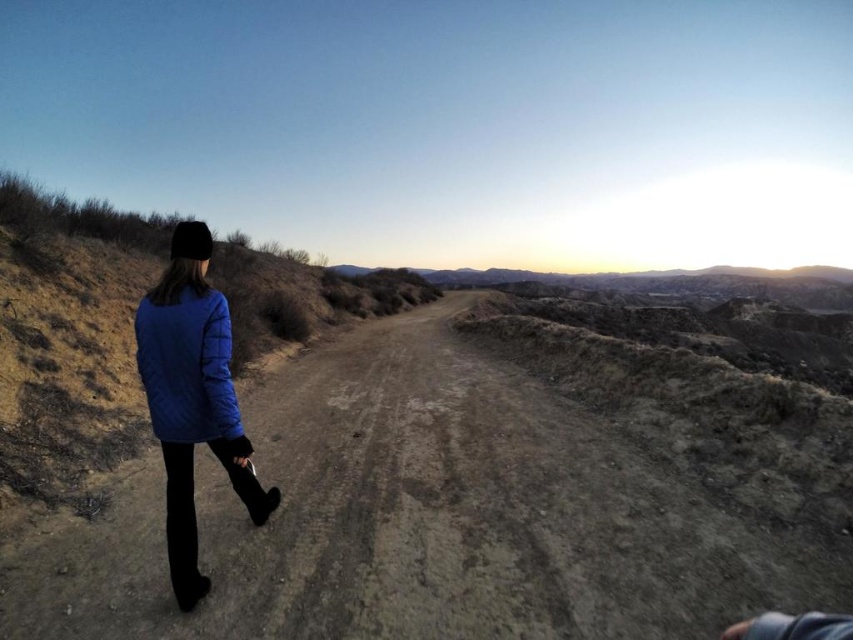
Question: Is blue quilted jacket at lower left thinner than matte blue jacket at lower left?

Choices:
 (A) yes
 (B) no

Answer: (B)

Question: Based on their relative distances, which object is nearer to the dull brown dirt track at center?

Choices:
 (A) blue quilted jacket at lower left
 (B) matte blue jacket at lower left

Answer: (A)

Question: Among these objects, which one is farthest from the camera?

Choices:
 (A) matte blue jacket at lower left
 (B) blue quilted jacket at lower left
 (C) dull brown dirt track at center

Answer: (A)

Question: Which is farther from the matte blue jacket at lower left?

Choices:
 (A) blue quilted jacket at lower left
 (B) dull brown dirt track at center

Answer: (B)

Question: From the image, what is the correct spatial relationship of dull brown dirt track at center in relation to blue quilted jacket at lower left?

Choices:
 (A) above
 (B) below

Answer: (B)

Question: Observing the image, what is the correct spatial positioning of blue quilted jacket at lower left in reference to matte blue jacket at lower left?

Choices:
 (A) right
 (B) left

Answer: (A)